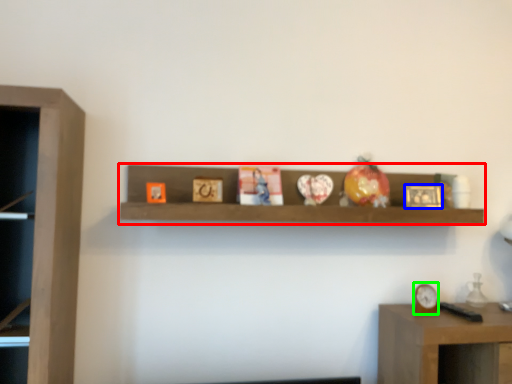
Question: Estimate the real-world distances between objects in this image. Which object is closer to shelf (highlighted by a red box), picture frame (highlighted by a blue box) or clock (highlighted by a green box)?

Choices:
 (A) picture frame
 (B) clock

Answer: (A)